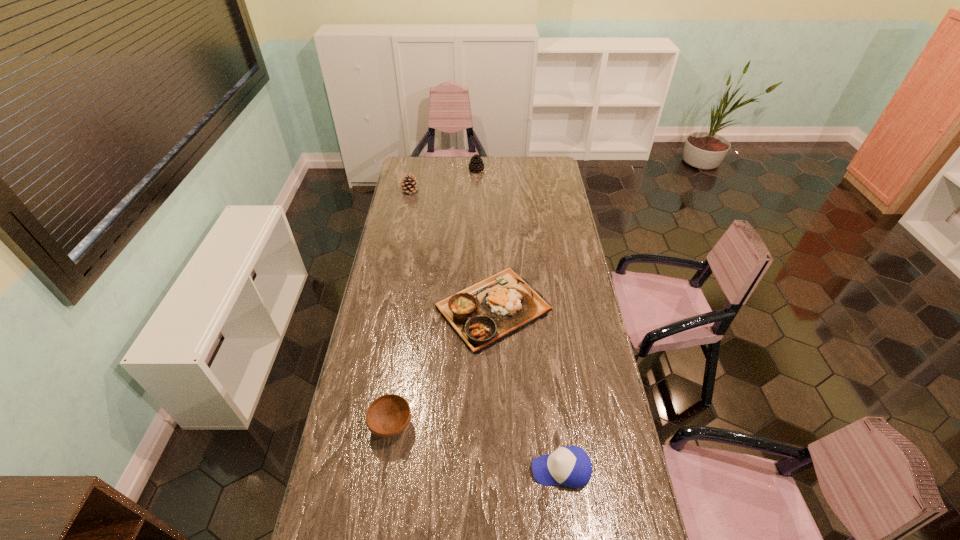
You are a GUI agent. You are given a task and a screenshot of the screen. Output one action in this format:
    pyautogui.click(x=<x>, y=<y>)
    Task: Click on the left pinecone
    This screenshot has width=960, height=540.
    Given the screenshot: What is the action you would take?
    409,185

Where is `the nearer pinecone`? This screenshot has height=540, width=960. the nearer pinecone is located at coordinates (409, 185).

Where is `the right pinecone`? This screenshot has width=960, height=540. the right pinecone is located at coordinates (476, 164).

Where is `the farthest object`? The width and height of the screenshot is (960, 540). the farthest object is located at coordinates (476, 164).

Locate an element on the screen. This screenshot has height=540, width=960. platter is located at coordinates (482, 315).

Where is `baseball cap`? baseball cap is located at coordinates (570, 466).

The image size is (960, 540). What are the coordinates of `bowl` in the screenshot? It's located at (387, 416).

At what (x,y) coordinates should I click in order to perform the action: click on free space located 0.110m on the right of the fifth nearest object. Please return your answer as a coordinate pair (x, y). Looking at the image, I should click on (438, 191).

Locate an element on the screen. vacant region located at the narrow end of the farther pinecone is located at coordinates (545, 170).

In order to click on free space located on the back of the platter in this screenshot , I will do `click(490, 241)`.